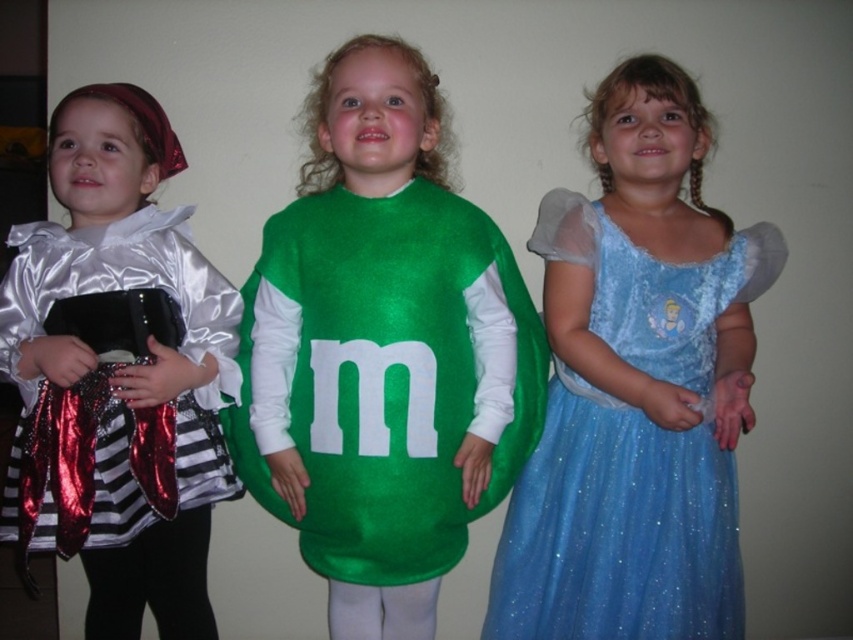
You are a photographer setting up a tripod to take a group photo of the children. The shiny silver dress at left and the glittery blue dress at center are the main subjects. Which child should you position closer to the front of the group to ensure both are in focus?

The glittery blue dress at center should be positioned closer to the front because the shiny silver dress at left is much taller, so moving the shorter glittery blue dress at center forward will help keep both subjects in focus.

You are a photographer setting up for a group photo. You have two main focal points in the scene, the green shiny candy at center and the glittery blue dress at center. Which object should you focus on if you want to capture the larger one in detail?

The green shiny candy at center has a larger size compared to the glittery blue dress at center, so you should focus on the green shiny candy at center to capture the larger one in detail.